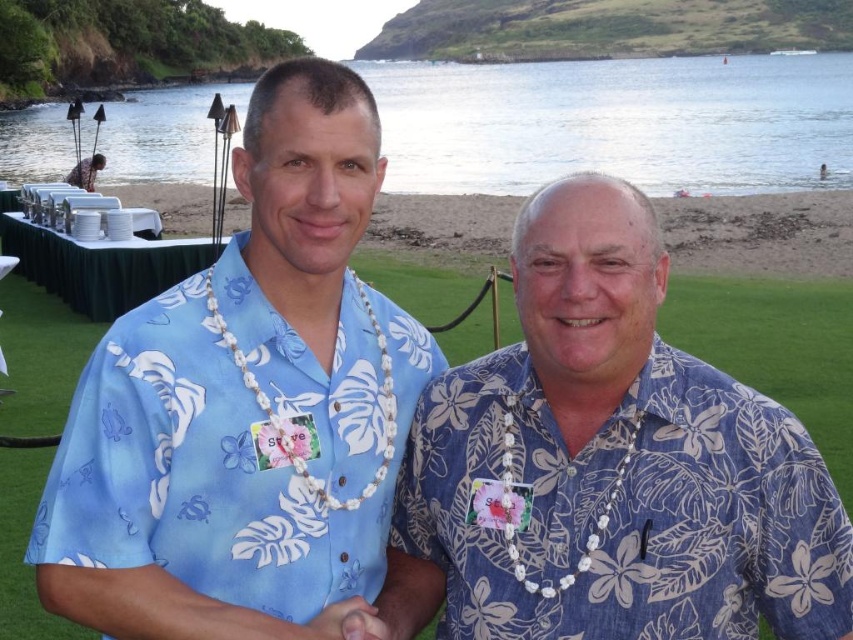
Question: From the image, what is the correct spatial relationship of blue floral print shirt at center in relation to green grass at center?

Choices:
 (A) left
 (B) right

Answer: (B)

Question: Based on their relative distances, which object is farther from the beach sand at lower center?

Choices:
 (A) clear water at beach left
 (B) blue floral shirt at center
 (C) green grass at center
 (D) blue floral print shirt at center

Answer: (A)

Question: Estimate the real-world distances between objects in this image. Which object is farther from the blue floral print shirt at center?

Choices:
 (A) beach sand at lower center
 (B) clear water at beach left
 (C) green grass at center
 (D) blue floral shirt at center

Answer: (B)

Question: Can you confirm if clear water at beach left is wider than green grass at center?

Choices:
 (A) yes
 (B) no

Answer: (A)

Question: Can you confirm if blue floral shirt at center is smaller than blue floral print shirt at center?

Choices:
 (A) yes
 (B) no

Answer: (B)

Question: Which point is closer to the camera?

Choices:
 (A) (396, 100)
 (B) (465, 337)
 (C) (520, 504)

Answer: (C)